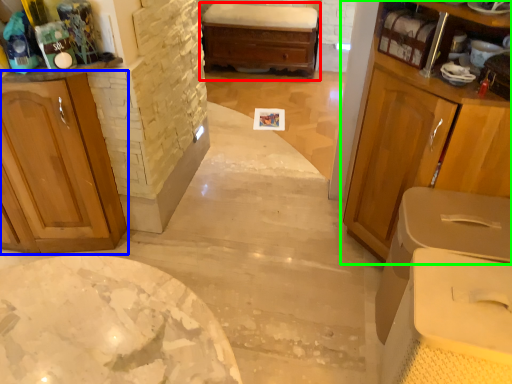
Question: Which is nearer to the chest of drawers (highlighted by a red box)? cabinetry (highlighted by a blue box) or cabinetry (highlighted by a green box).

Choices:
 (A) cabinetry
 (B) cabinetry

Answer: (B)